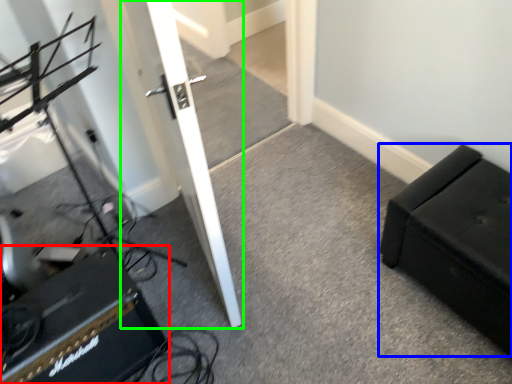
Question: Which object is positioned closest to speaker (highlighted by a red box)? Select from furniture (highlighted by a blue box) and door (highlighted by a green box).

Choices:
 (A) furniture
 (B) door

Answer: (B)